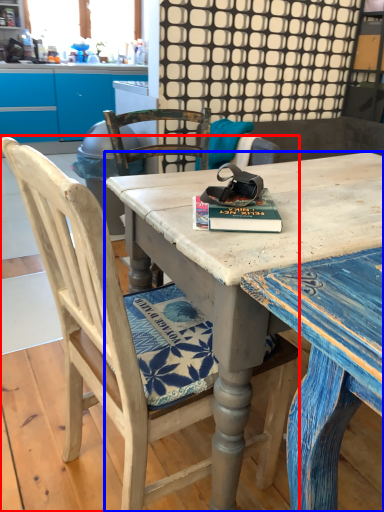
Question: Which point is closer to the camera, chair (highlighted by a red box) or desk (highlighted by a blue box)?

Choices:
 (A) chair
 (B) desk

Answer: (A)